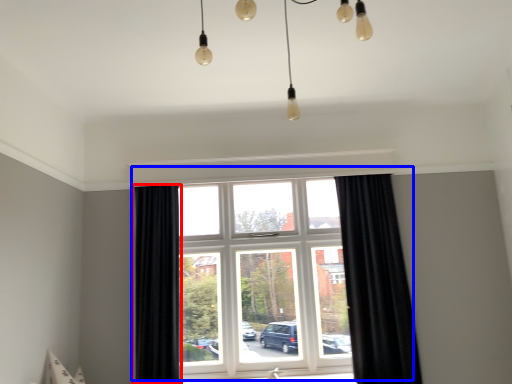
Question: Which point is further to the camera, curtain (highlighted by a red box) or window (highlighted by a blue box)?

Choices:
 (A) curtain
 (B) window

Answer: (B)